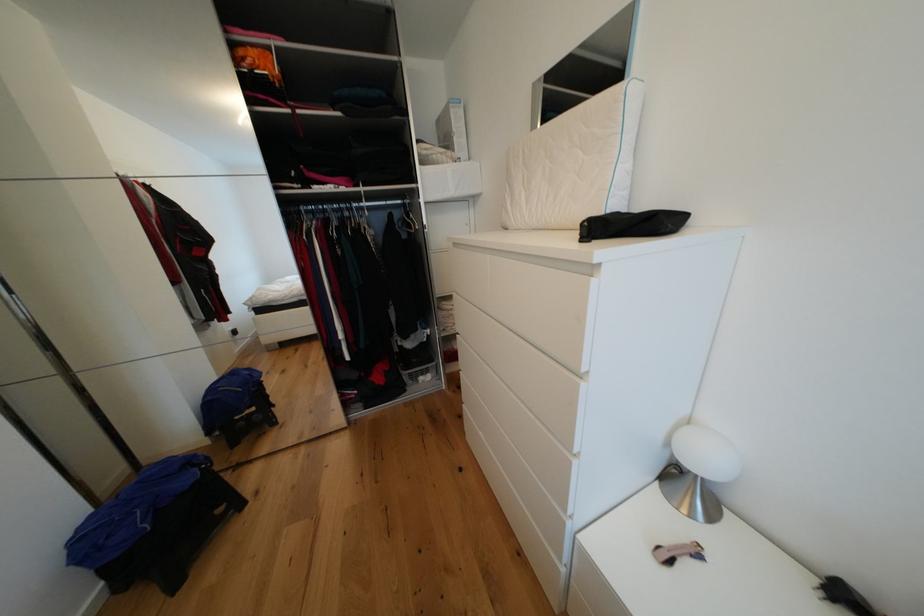
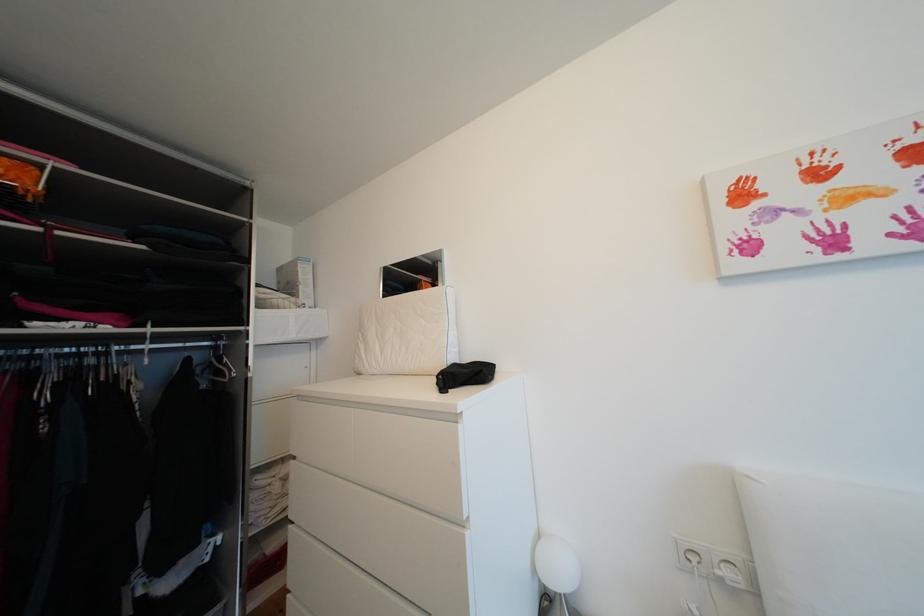
Find the pixel in the second image that matches (x=646, y=209) in the first image.

(473, 362)